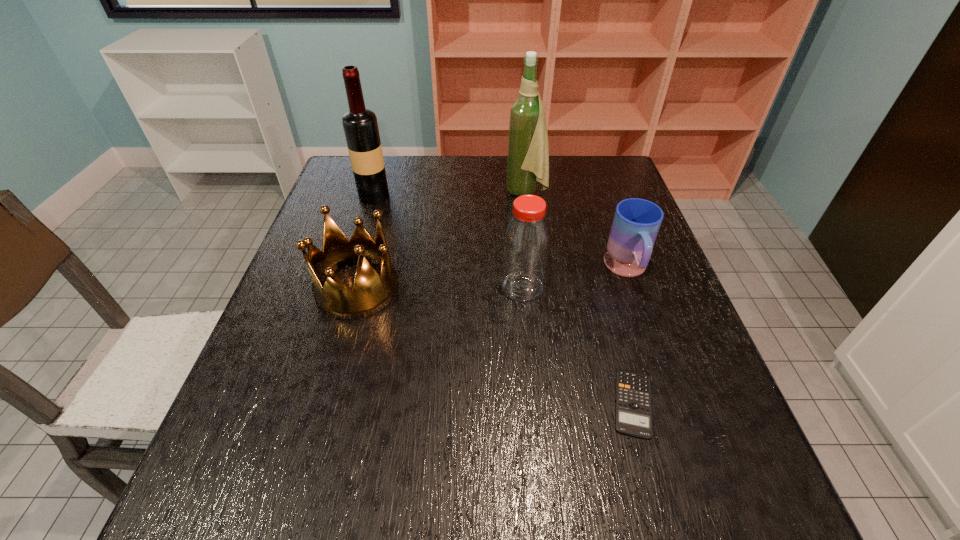
Identify the location of free space located 0.300m on the front of the left wine bottle. This screenshot has height=540, width=960. (349, 276).

The width and height of the screenshot is (960, 540). I want to click on vacant area situated 0.200m on the back of the bottle, so (516, 222).

This screenshot has width=960, height=540. Identify the location of vacant space located on the right of the crown. (492, 288).

I want to click on vacant space located on the side of the mug with the handle, so click(x=647, y=327).

Image resolution: width=960 pixels, height=540 pixels. I want to click on vacant space situated on the left of the shortest object, so click(474, 403).

In order to click on wine bottle located at the left edge in this screenshot , I will do `click(360, 125)`.

Where is `crown at the left edge`? crown at the left edge is located at coordinates tap(371, 292).

Where is `mug that is at the right edge`? This screenshot has width=960, height=540. mug that is at the right edge is located at coordinates (636, 223).

Locate an element on the screen. The image size is (960, 540). calculator present at the right edge is located at coordinates (633, 415).

The height and width of the screenshot is (540, 960). What are the coordinates of `object that is positioned at the far left corner` in the screenshot? It's located at (360, 125).